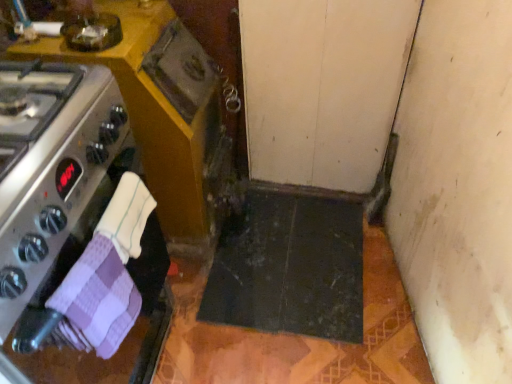
You are a GUI agent. You are given a task and a screenshot of the screen. Output one action in this format:
    pyautogui.click(x=<x>, y=<y>)
    Task: Click on the white textured hand towel at lower left, the 1th hand towel from the top
    
    Given the screenshot: What is the action you would take?
    pyautogui.click(x=127, y=216)

This screenshot has height=384, width=512. Describe the element at coordinates (162, 112) in the screenshot. I see `matte wood cabinet at lower center` at that location.

How much space does purple checkered cloth at left, which ranks as the 1th hand towel in bottom-to-top order, occupy vertically?

It is 20.12 centimeters.

At what (x,y) coordinates should I click in order to perform the action: click on white textured hand towel at lower left, which appears as the 2th hand towel when ordered from the bottom. Please return your answer as a coordinate pair (x, y). Looking at the image, I should click on (127, 216).

From the image's perspective, between purple checkered cloth at left, which ranks as the 1th hand towel in bottom-to-top order, and satin silver oven at left, which one is located above?

satin silver oven at left is shown above in the image.

Is point (106, 294) positioned in front of point (64, 156)?

That is False.

Considering the relative positions of purple checkered cloth at left, which ranks as the 1th hand towel in bottom-to-top order, and satin silver oven at left in the image provided, is purple checkered cloth at left, which ranks as the 1th hand towel in bottom-to-top order, to the left or to the right of satin silver oven at left?

Based on their positions, purple checkered cloth at left, which ranks as the 1th hand towel in bottom-to-top order, is located to the right of satin silver oven at left.

Locate an element on the screen. kitchen appliance on the left side of purple checkered cloth at left, which ranks as the 1th hand towel in bottom-to-top order is located at coordinates (68, 214).

Considering the points (103, 230) and (89, 261), which point is behind, point (103, 230) or point (89, 261)?

The point (103, 230) is behind.

From a real-world perspective, is white textured hand towel at lower left, which appears as the 2th hand towel when ordered from the bottom, physically located above or below purple checkered cloth at left, arranged as the 2th hand towel when viewed from the top?

Clearly, from a real-world perspective, white textured hand towel at lower left, which appears as the 2th hand towel when ordered from the bottom, is above purple checkered cloth at left, arranged as the 2th hand towel when viewed from the top.

Based on the photo, who is bigger, white textured hand towel at lower left, which appears as the 2th hand towel when ordered from the bottom, or purple checkered cloth at left, which ranks as the 1th hand towel in bottom-to-top order?

purple checkered cloth at left, which ranks as the 1th hand towel in bottom-to-top order.

Would you say white textured hand towel at lower left, the 1th hand towel from the top, is a long distance from purple checkered cloth at left, arranged as the 2th hand towel when viewed from the top?

They are positioned close to each other.

Based on their sizes in the image, would you say matte wood cabinet at lower center is bigger or smaller than satin silver oven at left?

Clearly, matte wood cabinet at lower center is larger in size than satin silver oven at left.

Considering the relative sizes of matte wood cabinet at lower center and satin silver oven at left in the image provided, is matte wood cabinet at lower center shorter than satin silver oven at left?

No.

Is matte wood cabinet at lower center far from satin silver oven at left?

matte wood cabinet at lower center is actually quite close to satin silver oven at left.

Is point (162, 134) closer or farther from the camera than point (116, 359)?

Point (162, 134) is farther from the camera than point (116, 359).

From a real-world perspective, is purple checkered cloth at left, arranged as the 2th hand towel when viewed from the top, on white textured hand towel at lower left, which appears as the 2th hand towel when ordered from the bottom?

No, from a real-world perspective, purple checkered cloth at left, arranged as the 2th hand towel when viewed from the top, is not above white textured hand towel at lower left, which appears as the 2th hand towel when ordered from the bottom.

Are purple checkered cloth at left, which ranks as the 1th hand towel in bottom-to-top order, and white textured hand towel at lower left, the 1th hand towel from the top, located far from each other?

That's not correct — purple checkered cloth at left, which ranks as the 1th hand towel in bottom-to-top order, is a little close to white textured hand towel at lower left, the 1th hand towel from the top.

Consider the image. Is the depth of purple checkered cloth at left, arranged as the 2th hand towel when viewed from the top, less than that of white textured hand towel at lower left, the 1th hand towel from the top?

That is True.

Considering the sizes of satin silver oven at left and white textured hand towel at lower left, which appears as the 2th hand towel when ordered from the bottom, in the image, is satin silver oven at left wider or thinner than white textured hand towel at lower left, which appears as the 2th hand towel when ordered from the bottom,?

In the image, satin silver oven at left appears to be wider than white textured hand towel at lower left, which appears as the 2th hand towel when ordered from the bottom.

Does satin silver oven at left touch white textured hand towel at lower left, which appears as the 2th hand towel when ordered from the bottom?

satin silver oven at left and white textured hand towel at lower left, which appears as the 2th hand towel when ordered from the bottom, are clearly separated.

Considering the positions of objects satin silver oven at left and white textured hand towel at lower left, the 1th hand towel from the top, in the image provided, who is more to the right, satin silver oven at left or white textured hand towel at lower left, the 1th hand towel from the top,?

Positioned to the right is white textured hand towel at lower left, the 1th hand towel from the top.

Identify the location of kitchen appliance above the white textured hand towel at lower left, which appears as the 2th hand towel when ordered from the bottom (from the image's perspective). (68, 214).

Can you see white textured hand towel at lower left, which appears as the 2th hand towel when ordered from the bottom, touching matte wood cabinet at lower center?

No, white textured hand towel at lower left, which appears as the 2th hand towel when ordered from the bottom, is not in contact with matte wood cabinet at lower center.

Between point (109, 208) and point (23, 46), which one is positioned behind?

Point (23, 46)

Considering the sizes of objects white textured hand towel at lower left, which appears as the 2th hand towel when ordered from the bottom, and matte wood cabinet at lower center in the image provided, who is wider, white textured hand towel at lower left, which appears as the 2th hand towel when ordered from the bottom, or matte wood cabinet at lower center?

Wider between the two is matte wood cabinet at lower center.

Where is `the 1st hand towel in front of the matte wood cabinet at lower center`? the 1st hand towel in front of the matte wood cabinet at lower center is located at coordinates coord(127,216).

Is purple checkered cloth at left, arranged as the 2th hand towel when viewed from the top, wider or thinner than matte wood cabinet at lower center?

Considering their sizes, purple checkered cloth at left, arranged as the 2th hand towel when viewed from the top, looks slimmer than matte wood cabinet at lower center.

In the scene shown: Which object is positioned more to the right, purple checkered cloth at left, arranged as the 2th hand towel when viewed from the top, or matte wood cabinet at lower center?

purple checkered cloth at left, arranged as the 2th hand towel when viewed from the top.

Considering the sizes of purple checkered cloth at left, which ranks as the 1th hand towel in bottom-to-top order, and matte wood cabinet at lower center in the image, is purple checkered cloth at left, which ranks as the 1th hand towel in bottom-to-top order, bigger or smaller than matte wood cabinet at lower center?

purple checkered cloth at left, which ranks as the 1th hand towel in bottom-to-top order, is smaller than matte wood cabinet at lower center.

The height and width of the screenshot is (384, 512). I want to click on kitchen appliance that is above the purple checkered cloth at left, which ranks as the 1th hand towel in bottom-to-top order (from the image's perspective), so click(68, 214).

In order to click on hand towel behind the purple checkered cloth at left, which ranks as the 1th hand towel in bottom-to-top order in this screenshot , I will do `click(127, 216)`.

Looking at the image, which one is located closer to matte wood cabinet at lower center, white textured hand towel at lower left, which appears as the 2th hand towel when ordered from the bottom, or purple checkered cloth at left, which ranks as the 1th hand towel in bottom-to-top order?

Among the two, white textured hand towel at lower left, which appears as the 2th hand towel when ordered from the bottom, is located nearer to matte wood cabinet at lower center.

Estimate the real-world distances between objects in this image. Which object is further from satin silver oven at left, purple checkered cloth at left, which ranks as the 1th hand towel in bottom-to-top order, or white textured hand towel at lower left, the 1th hand towel from the top?

white textured hand towel at lower left, the 1th hand towel from the top, is further to satin silver oven at left.

When comparing their distances from purple checkered cloth at left, arranged as the 2th hand towel when viewed from the top, does satin silver oven at left or matte wood cabinet at lower center seem closer?

Among the two, satin silver oven at left is located nearer to purple checkered cloth at left, arranged as the 2th hand towel when viewed from the top.

When comparing their distances from satin silver oven at left, does white textured hand towel at lower left, which appears as the 2th hand towel when ordered from the bottom, or matte wood cabinet at lower center seem further?

matte wood cabinet at lower center lies further to satin silver oven at left than the other object.

Based on the photo, which object lies further to the anchor point purple checkered cloth at left, arranged as the 2th hand towel when viewed from the top, matte wood cabinet at lower center or satin silver oven at left?

matte wood cabinet at lower center is further to purple checkered cloth at left, arranged as the 2th hand towel when viewed from the top.

Looking at the image, which one is located closer to white textured hand towel at lower left, which appears as the 2th hand towel when ordered from the bottom, satin silver oven at left or matte wood cabinet at lower center?

Based on the image, satin silver oven at left appears to be nearer to white textured hand towel at lower left, which appears as the 2th hand towel when ordered from the bottom.

When comparing their distances from white textured hand towel at lower left, which appears as the 2th hand towel when ordered from the bottom, does purple checkered cloth at left, which ranks as the 1th hand towel in bottom-to-top order, or satin silver oven at left seem closer?

purple checkered cloth at left, which ranks as the 1th hand towel in bottom-to-top order.

Looking at the image, which one is located closer to purple checkered cloth at left, arranged as the 2th hand towel when viewed from the top, satin silver oven at left or white textured hand towel at lower left, the 1th hand towel from the top?

The object closer to purple checkered cloth at left, arranged as the 2th hand towel when viewed from the top, is white textured hand towel at lower left, the 1th hand towel from the top.

This screenshot has height=384, width=512. Identify the location of hand towel between satin silver oven at left and white textured hand towel at lower left, which appears as the 2th hand towel when ordered from the bottom, along the z-axis. (95, 301).

Locate an element on the screen. hand towel between matte wood cabinet at lower center and purple checkered cloth at left, arranged as the 2th hand towel when viewed from the top, from top to bottom is located at coordinates [127, 216].